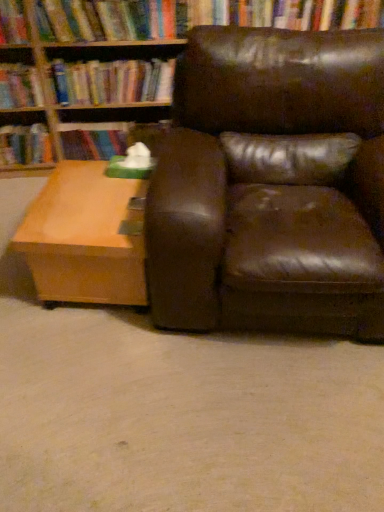
You are a GUI agent. You are given a task and a screenshot of the screen. Output one action in this format:
    pyautogui.click(x=<x>, y=<y>)
    Task: Click on the vacant location below hardcover book at upper left, which is the 3th book from right to left (from a real-world perspective)
    Image resolution: width=384 pixels, height=512 pixels.
    Given the screenshot: What is the action you would take?
    pyautogui.click(x=27, y=125)